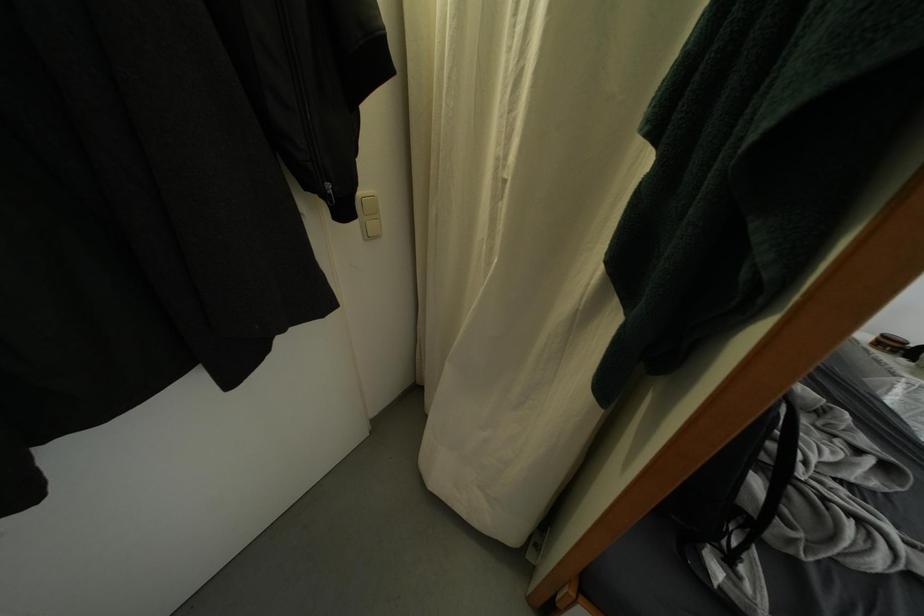
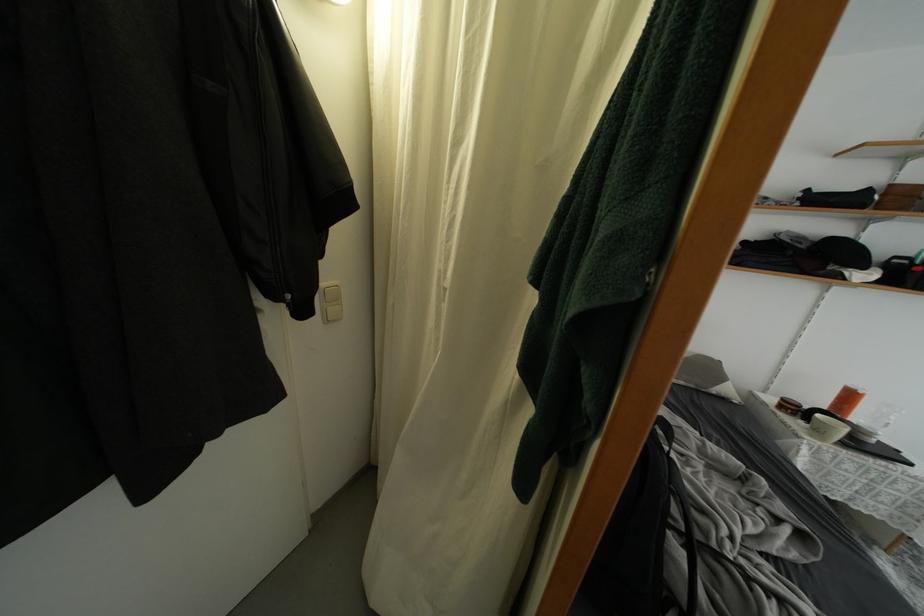
Where in the second image is the point corresponding to point (853, 419) from the first image?

(769, 485)